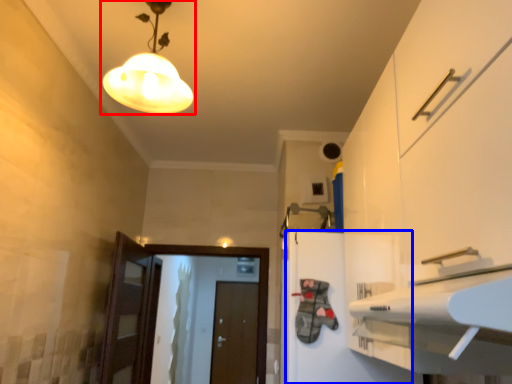
Question: Which point is closer to the camera, lamp (highlighted by a red box) or cabinetry (highlighted by a blue box)?

Choices:
 (A) lamp
 (B) cabinetry

Answer: (A)